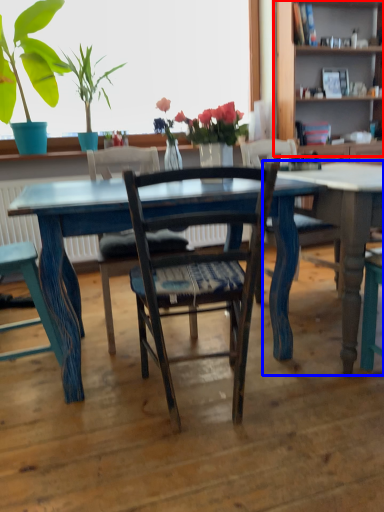
Question: Among these objects, which one is farthest to the camera, bookshelf (highlighted by a red box) or table (highlighted by a blue box)?

Choices:
 (A) bookshelf
 (B) table

Answer: (A)